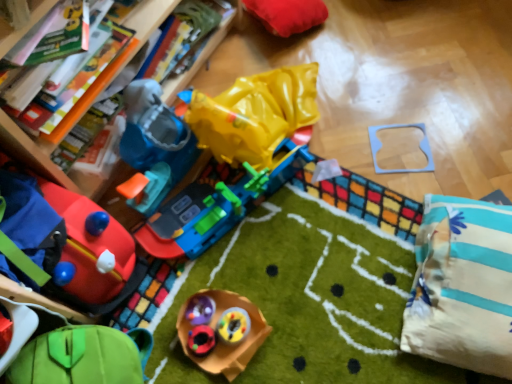
Image resolution: width=512 pixels, height=384 pixels. Find the location of `vacant space behind rubberized plastic toy at center, which is the third toy from bottom to top`. vacant space behind rubberized plastic toy at center, which is the third toy from bottom to top is located at coordinates (228, 294).